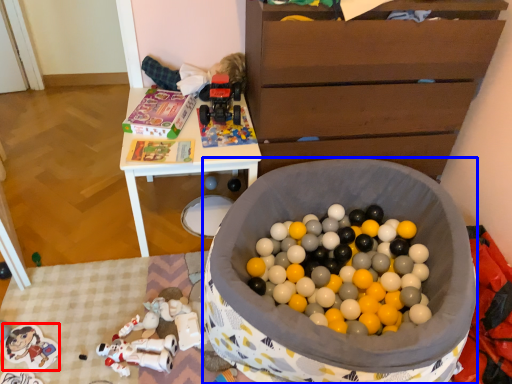
Question: Which object appears farthest to the camera in this image, toy (highlighted by a red box) or toy (highlighted by a blue box)?

Choices:
 (A) toy
 (B) toy

Answer: (A)